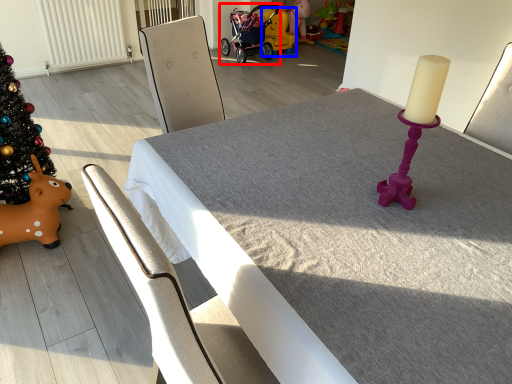
Question: Among these objects, which one is farthest to the camera, baby carriage (highlighted by a red box) or toy (highlighted by a blue box)?

Choices:
 (A) baby carriage
 (B) toy

Answer: (B)